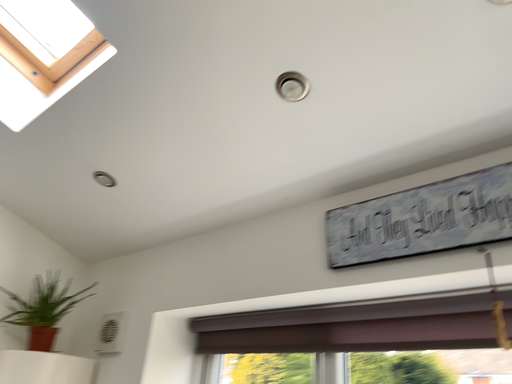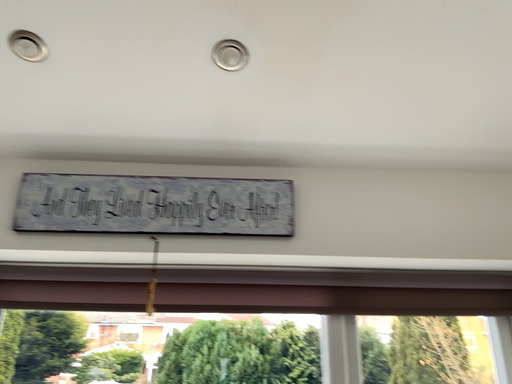
Question: How did the camera likely rotate when shooting the video?

Choices:
 (A) rotated left
 (B) rotated right

Answer: (B)